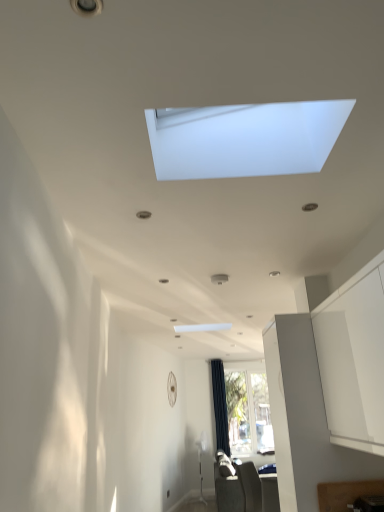
Question: Is black fabric curtain at center wider or thinner than dark gray fabric sofa at lower center, arranged as the 2th furniture when viewed from the front?

Choices:
 (A) thin
 (B) wide

Answer: (A)

Question: Considering the positions of black fabric curtain at center and dark gray fabric sofa at lower center, arranged as the 2th furniture when viewed from the front, in the image, is black fabric curtain at center taller or shorter than dark gray fabric sofa at lower center, arranged as the 2th furniture when viewed from the front,?

Choices:
 (A) tall
 (B) short

Answer: (A)

Question: Estimate the real-world distances between objects in this image. Which object is closer to the white matte window at upper center, positioned as the 1th window in top-to-bottom order?

Choices:
 (A) clear glass window at center, arranged as the 1th window when ordered from the bottom
 (B) wooden cutting board at lower right, which ranks as the 1th furniture in top-to-bottom order
 (C) black fabric curtain at center
 (D) dark gray fabric sofa at lower center, which is the first furniture in back-to-front order

Answer: (B)

Question: Estimate the real-world distances between objects in this image. Which object is farther from the clear glass window at center, arranged as the 1th window when ordered from the bottom?

Choices:
 (A) white matte window at upper center, the second window in the back-to-front sequence
 (B) wooden cutting board at lower right, which ranks as the 1th furniture in top-to-bottom order
 (C) black fabric curtain at center
 (D) dark gray fabric sofa at lower center, placed as the second furniture when sorted from top to bottom

Answer: (A)